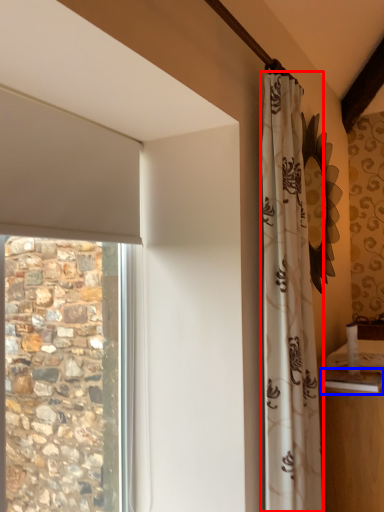
Question: Which point is further to the camera, curtain (highlighted by a red box) or counter top (highlighted by a blue box)?

Choices:
 (A) curtain
 (B) counter top

Answer: (B)